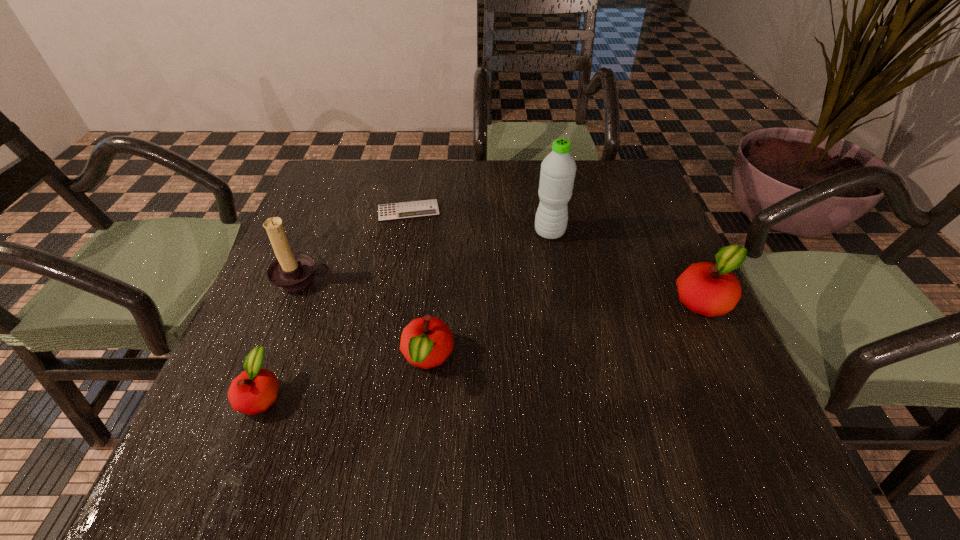
This screenshot has height=540, width=960. What are the coordinates of `the fifth object from left to right` in the screenshot? It's located at (558, 169).

Locate an element on the screen. The width and height of the screenshot is (960, 540). free space located on the back of the leftmost apple is located at coordinates point(287,329).

This screenshot has width=960, height=540. What are the coordinates of `free space located 0.390m on the right of the second apple from left to right` in the screenshot? It's located at (665, 358).

You are a GUI agent. You are given a task and a screenshot of the screen. Output one action in this format:
    pyautogui.click(x=<x>, y=<y>)
    Task: Click on the free space located on the left of the rightmost apple
    The width and height of the screenshot is (960, 540).
    Given the screenshot: What is the action you would take?
    pyautogui.click(x=624, y=300)

Identify the location of blank area located 0.170m on the back of the calculator. (418, 166).

Identify the location of free space located 0.220m on the wick of the second tallest object. (258, 388).

This screenshot has width=960, height=540. I want to click on blank space located on the left of the water bottle, so click(460, 233).

Locate an element on the screen. This screenshot has height=540, width=960. object at the far edge is located at coordinates coord(426,208).

You are a GUI agent. You are given a task and a screenshot of the screen. Output one action in this format:
    pyautogui.click(x=<x>, y=<y>)
    Task: Click on the apple positioned at the left edge
    This screenshot has width=960, height=540.
    Given the screenshot: What is the action you would take?
    pyautogui.click(x=253, y=391)

You are a GUI agent. You are given a task and a screenshot of the screen. Output one action in this format:
    pyautogui.click(x=<x>, y=<y>)
    Task: Click on the candle holder located at the left edge
    This screenshot has height=540, width=960.
    Given the screenshot: What is the action you would take?
    pyautogui.click(x=290, y=272)